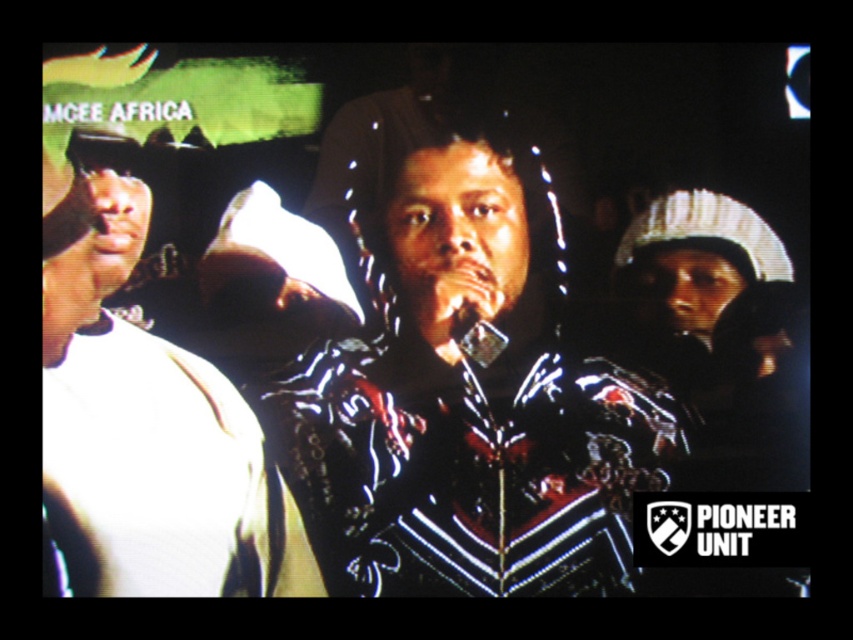
You are a photographer positioned in front of the scene. You need to capture a clear photo of both the white matte shirt at left and the metallic silver microphone at center. Which object will appear larger in the photo?

The white matte shirt at left will appear larger in the photo because it is closer to the viewer than the metallic silver microphone at center.

You are a stagehand who needs to ensure that the shiny black jacket at center and the metallic silver microphone at center are positioned so that the microphone is clearly visible to the audience. Given their sizes, which object should be placed closer to the front of the stage to ensure visibility?

The metallic silver microphone at center should be placed closer to the front of the stage since the shiny black jacket at center is wider, so positioning the narrower microphone forward ensures it remains visible.